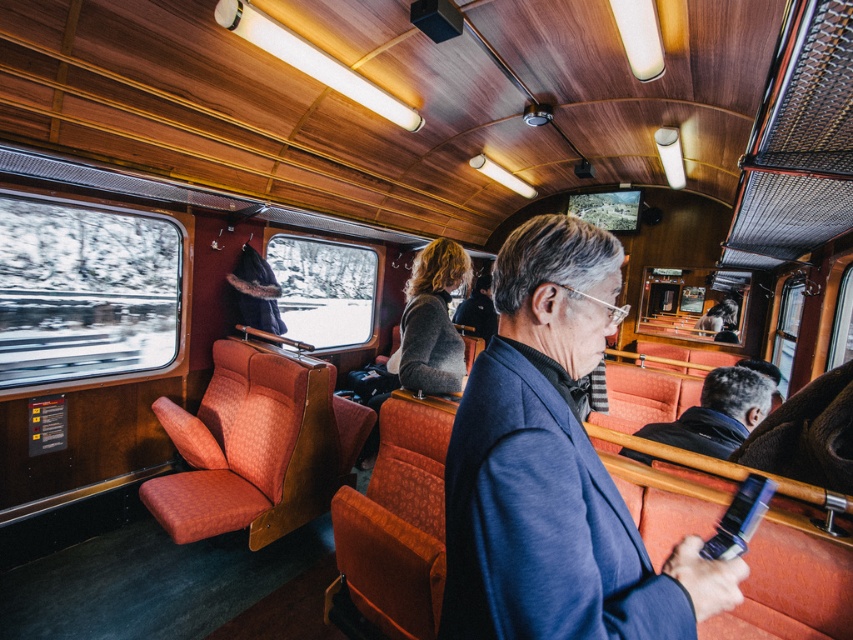
Question: Considering the relative positions of blue fabric coach at center and dark blue jacket at center in the image provided, where is blue fabric coach at center located with respect to dark blue jacket at center?

Choices:
 (A) left
 (B) right

Answer: (A)

Question: Which point is closer to the camera?

Choices:
 (A) dark blue jacket at center
 (B) blue fabric coach at center
 (C) dark gray sweater at center

Answer: (B)

Question: Which of the following is the farthest from the observer?

Choices:
 (A) (724, 396)
 (B) (415, 364)
 (C) (541, 486)

Answer: (B)

Question: Considering the real-world distances, which object is closest to the dark blue jacket at center?

Choices:
 (A) dark gray sweater at center
 (B) blue fabric coach at center

Answer: (A)

Question: Is blue fabric coach at center to the right of dark gray sweater at center from the viewer's perspective?

Choices:
 (A) no
 (B) yes

Answer: (B)

Question: Is blue fabric coach at center behind dark blue jacket at center?

Choices:
 (A) no
 (B) yes

Answer: (A)